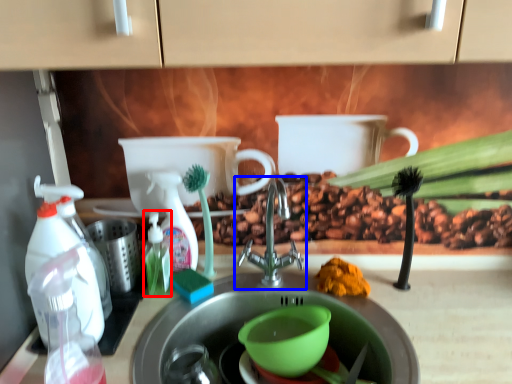
Question: Which object is closer to the camera taking this photo, bottle (highlighted by a red box) or tap (highlighted by a blue box)?

Choices:
 (A) bottle
 (B) tap

Answer: (B)